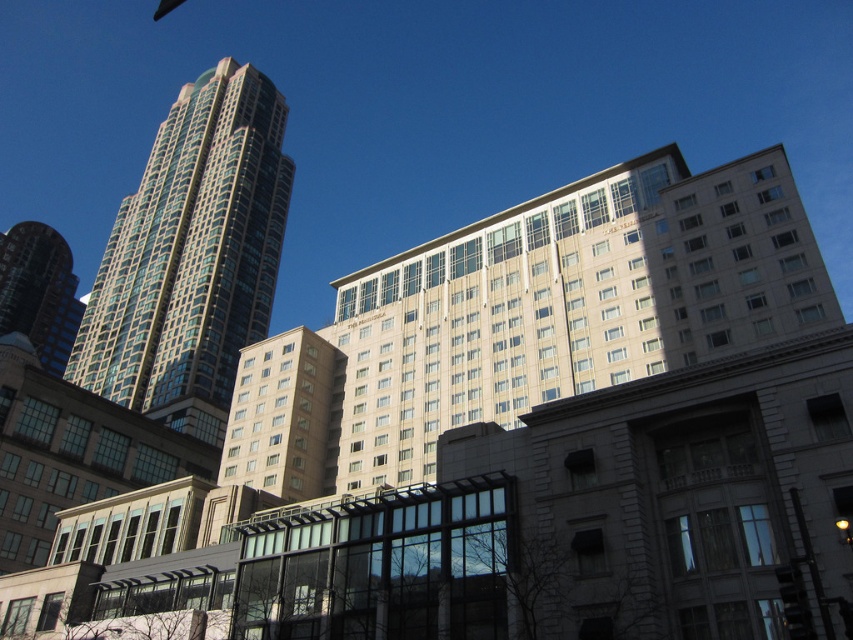
You are an architect analyzing the city skyline. You notice two skyscrapers in the scene. Based on their positions, which one is positioned higher in the sky? The options are the glassy teal skyscraper at upper left and the shiny glass skyscraper at left.

The glassy teal skyscraper at upper left is positioned higher in the sky than the shiny glass skyscraper at left.

You are an architect analyzing the city skyline. You notice the glassy teal skyscraper at upper left and the shiny glass skyscraper at left. Which of these two buildings has a greater width?

The glassy teal skyscraper at upper left has a greater width than the shiny glass skyscraper at left.

You are an architect analyzing the cityscape. You need to determine which of the two skyscrapers, the glassy teal skyscraper at upper left or the shiny glass skyscraper at left, is taller. Based on the scene, which one is taller?

The glassy teal skyscraper at upper left is taller than the shiny glass skyscraper at left according to the description.